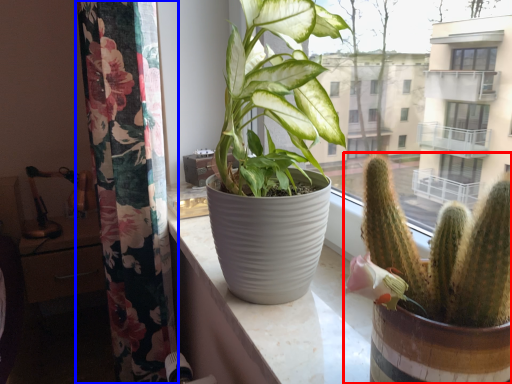
Question: Which object appears farthest to the camera in this image, houseplant (highlighted by a red box) or curtain (highlighted by a blue box)?

Choices:
 (A) houseplant
 (B) curtain

Answer: (B)